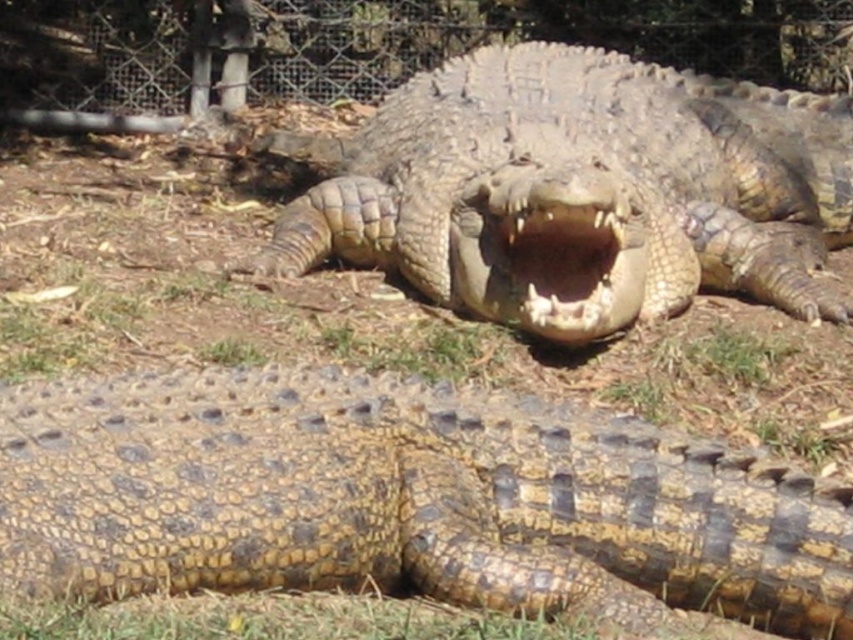
Question: Can you confirm if yellowish-brown scaly skin at center is thinner than leathery brown crocodile at center?

Choices:
 (A) yes
 (B) no

Answer: (A)

Question: Does leathery brown crocodile at center have a greater width compared to brown scaly mouth at center?

Choices:
 (A) yes
 (B) no

Answer: (A)

Question: Which point appears farthest from the camera in this image?

Choices:
 (A) (541, 209)
 (B) (483, 554)
 (C) (711, 284)

Answer: (C)

Question: Which object is the farthest from the leathery brown crocodile at center?

Choices:
 (A) yellowish-brown scaly skin at center
 (B) brown scaly mouth at center

Answer: (A)

Question: Is yellowish-brown scaly skin at center positioned in front of leathery brown crocodile at center?

Choices:
 (A) yes
 (B) no

Answer: (A)

Question: Which point appears farthest from the camera in this image?

Choices:
 (A) (805, 625)
 (B) (366, 221)
 (C) (556, 275)

Answer: (B)